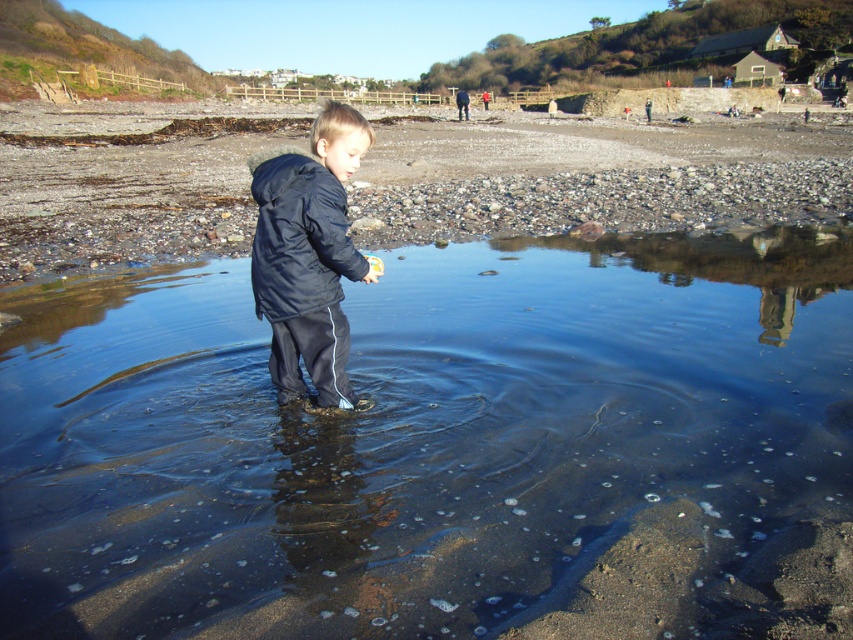
Question: Which point is closer to the camera?

Choices:
 (A) (358, 262)
 (B) (780, 465)
 (C) (280, 141)

Answer: (A)

Question: Which point is farther from the camera taking this photo?

Choices:
 (A) (257, 282)
 (B) (378, 324)

Answer: (B)

Question: Can you confirm if clear water at center is positioned above matte black jacket at center?

Choices:
 (A) yes
 (B) no

Answer: (B)

Question: Which of the following is the farthest from the observer?

Choices:
 (A) (627, 152)
 (B) (299, 310)

Answer: (A)

Question: Is clear water at center thinner than matte black jacket at center?

Choices:
 (A) yes
 (B) no

Answer: (A)

Question: Can you confirm if clear water at center is positioned above matte black jacket at center?

Choices:
 (A) no
 (B) yes

Answer: (A)